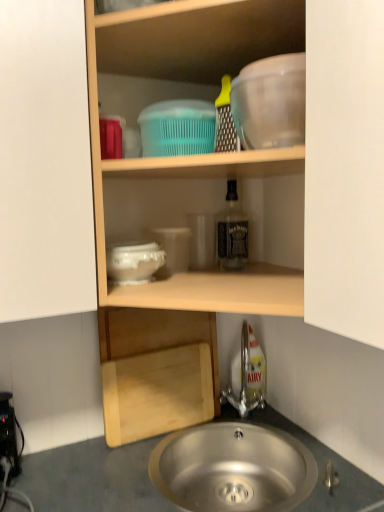
What are the coordinates of `unoccupied region to the right of black plastic power strip at lower left` in the screenshot? It's located at (72, 470).